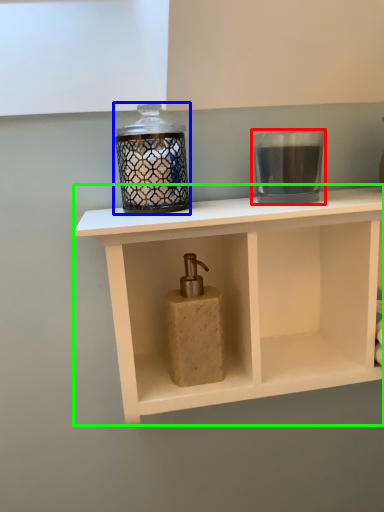
Question: Which object is the closest to the candle holder (highlighted by a red box)? Choose among these: candle holder (highlighted by a blue box) or shelf (highlighted by a green box).

Choices:
 (A) candle holder
 (B) shelf

Answer: (A)